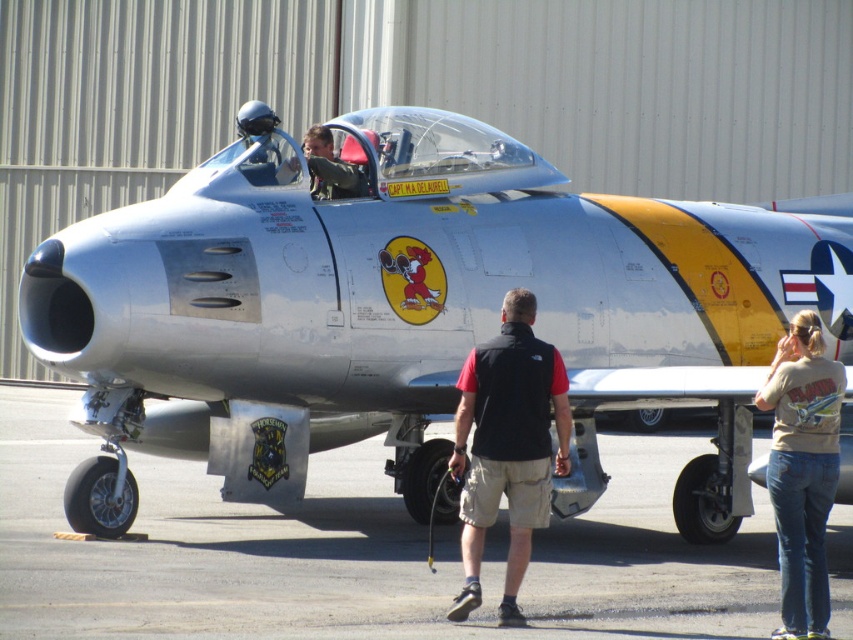
Is the position of silver metallic airplane at center less distant than that of tan cotton shirt at lower right?

No, silver metallic airplane at center is further to the viewer.

Which is in front, point (578, 481) or point (798, 522)?

Point (798, 522)

Is point (206, 195) positioned after point (786, 605)?

Yes, point (206, 195) is farther from viewer.

Image resolution: width=853 pixels, height=640 pixels. Find the location of `silver metallic airplane at center`. silver metallic airplane at center is located at coordinates (390, 298).

Who is more distant from viewer, (x=599, y=621) or (x=833, y=497)?

The point (x=599, y=621) is more distant.

Can you confirm if smooth asphalt tarmac at center is smaller than tan cotton shirt at lower right?

Incorrect, smooth asphalt tarmac at center is not smaller in size than tan cotton shirt at lower right.

At what (x,y) coordinates should I click in order to perform the action: click on smooth asphalt tarmac at center. Please return your answer as a coordinate pair (x, y). The width and height of the screenshot is (853, 640). Looking at the image, I should click on (355, 552).

Is smooth asphalt tarmac at center bigger than black fabric vest at center?

Yes.

Between point (601, 440) and point (476, 474), which one is positioned behind?

The point (601, 440) is more distant.

I want to click on smooth asphalt tarmac at center, so click(355, 552).